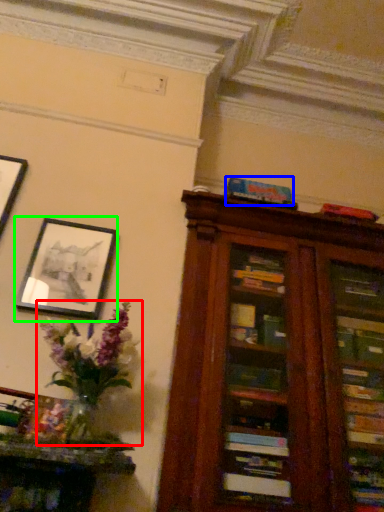
Question: Which object is the closest to the floral arrangement (highlighted by a red box)? Choose among these: paperback book (highlighted by a blue box) or picture frame (highlighted by a green box).

Choices:
 (A) paperback book
 (B) picture frame

Answer: (B)